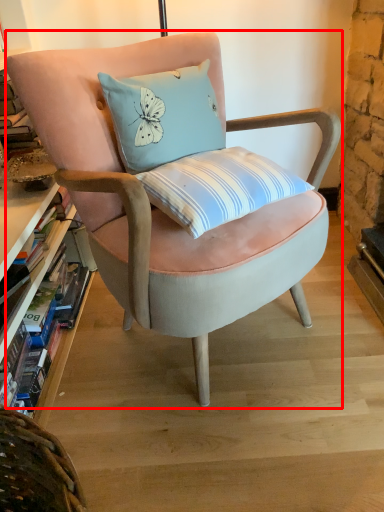
Question: Where is chair (annotated by the red box) located in relation to book in the image?

Choices:
 (A) right
 (B) left

Answer: (A)